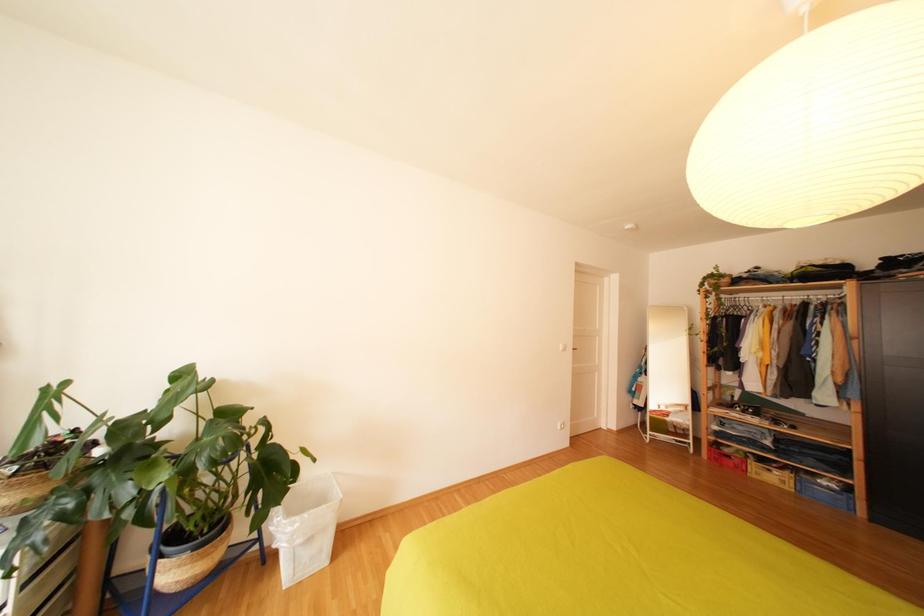
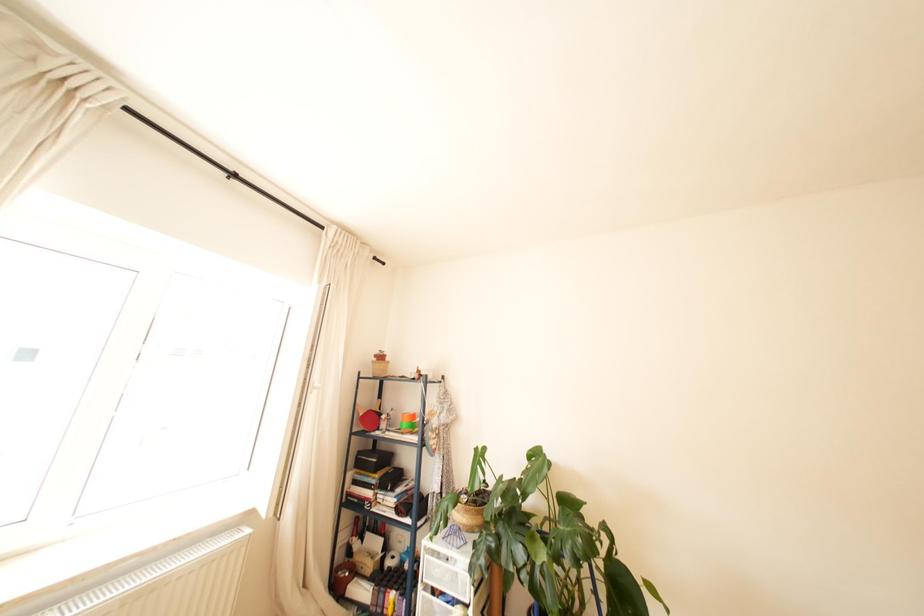
The first image is from the beginning of the video and the second image is from the end. How did the camera likely rotate when shooting the video?

The camera's rotation is toward left-up.